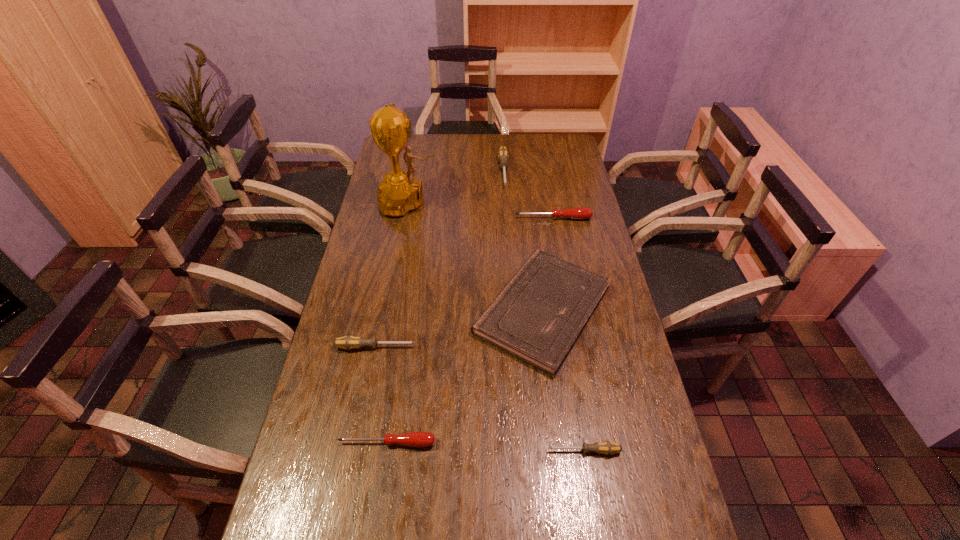
Where is `vacant region located at the tip of the nearest gray screwdriver`? Image resolution: width=960 pixels, height=540 pixels. vacant region located at the tip of the nearest gray screwdriver is located at coordinates (490, 451).

Identify the location of vacant area situated 0.310m at the tip of the nearest gray screwdriver. (420, 451).

You are a GUI agent. You are given a task and a screenshot of the screen. Output one action in this format:
    pyautogui.click(x=<x>, y=<y>)
    Task: Click on the object that is at the far edge
    This screenshot has width=960, height=540.
    Given the screenshot: What is the action you would take?
    point(503,154)

The width and height of the screenshot is (960, 540). Find the location of `award that is at the left edge`. award that is at the left edge is located at coordinates (399, 193).

Where is `paperback book positioned at the right edge`? This screenshot has height=540, width=960. paperback book positioned at the right edge is located at coordinates (539, 315).

Locate an element on the screen. The image size is (960, 540). free space at the far edge is located at coordinates (458, 153).

I want to click on vacant point at the left edge, so click(x=317, y=494).

Image resolution: width=960 pixels, height=540 pixels. I want to click on blank area at the right edge, so click(615, 382).

The image size is (960, 540). I want to click on free point between the smallest gray screwdriver and the paperback book, so click(x=564, y=380).

At what (x,y) coordinates should I click in order to perform the action: click on vacant area between the smallest gray screwdriver and the nearer red screwdriver. Please return your answer as a coordinate pair (x, y). The height and width of the screenshot is (540, 960). Looking at the image, I should click on (486, 447).